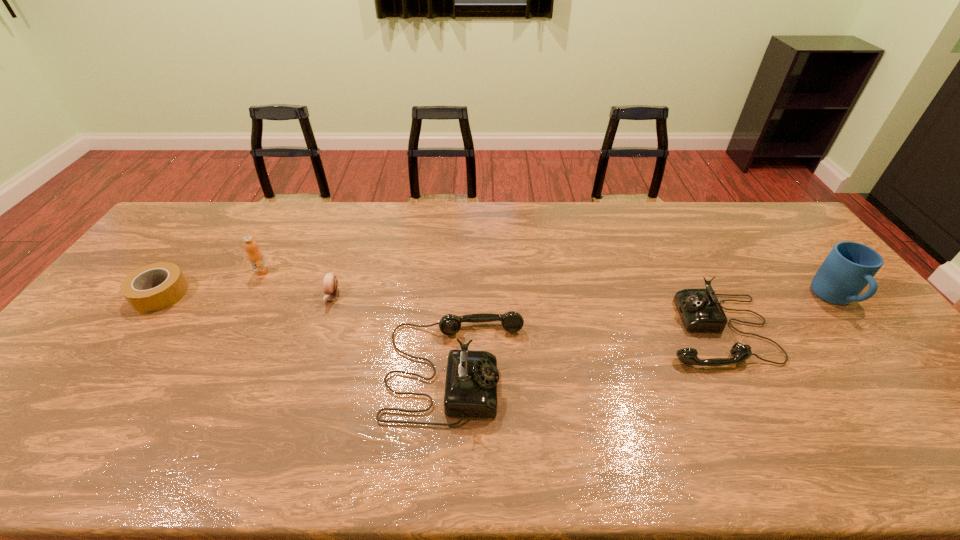
Identify the location of the fourth object from left to right. This screenshot has width=960, height=540. (471, 381).

The image size is (960, 540). In order to click on the taller telephone in this screenshot , I will do `click(471, 381)`.

Find the location of a particular element. the third shortest object is located at coordinates (700, 310).

You are a GUI agent. You are given a task and a screenshot of the screen. Output one action in this format:
    pyautogui.click(x=<x>, y=<y>)
    Task: Click on the fifth object from left to right
    This screenshot has width=960, height=540.
    Given the screenshot: What is the action you would take?
    (700, 310)

I want to click on orange juice, so click(255, 257).

This screenshot has height=540, width=960. What are the coordinates of `the second object from left to right` in the screenshot? It's located at (255, 257).

Image resolution: width=960 pixels, height=540 pixels. I want to click on escargot, so [x=330, y=282].

I want to click on duct tape, so click(135, 288).

The height and width of the screenshot is (540, 960). I want to click on the rightmost object, so click(850, 266).

Identify the location of vacant space located on the dial of the left telephone. Image resolution: width=960 pixels, height=540 pixels. (597, 369).